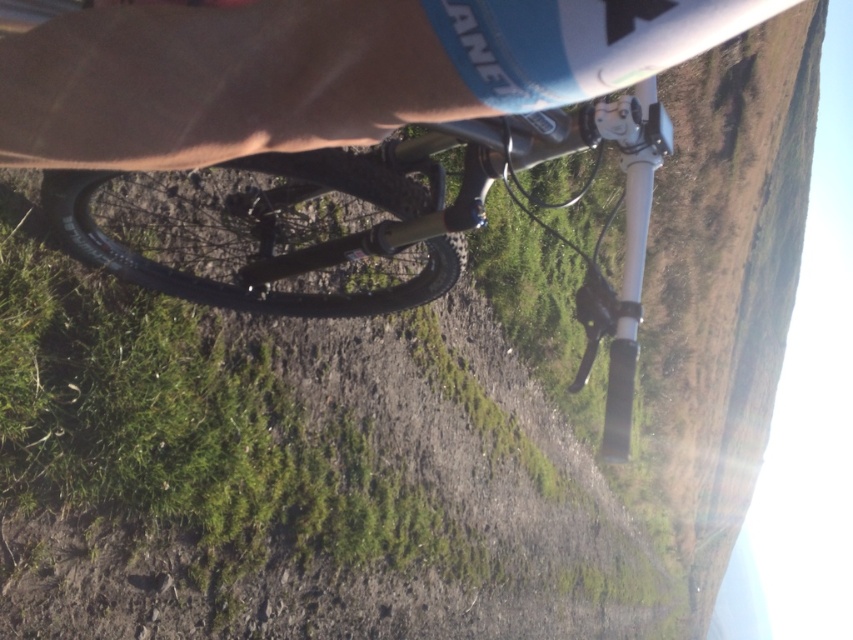
Question: Which object is closer to the camera taking this photo?

Choices:
 (A) shiny metallic bicycle at center
 (B) brown fabric at upper center

Answer: (B)

Question: Can you confirm if brown fabric at upper center is positioned above shiny metallic bicycle at center?

Choices:
 (A) yes
 (B) no

Answer: (A)

Question: Is brown fabric at upper center to the left of shiny metallic bicycle at center from the viewer's perspective?

Choices:
 (A) yes
 (B) no

Answer: (B)

Question: Does brown fabric at upper center appear under shiny metallic bicycle at center?

Choices:
 (A) no
 (B) yes

Answer: (A)

Question: Which point is farther to the camera?

Choices:
 (A) shiny metallic bicycle at center
 (B) brown fabric at upper center

Answer: (A)